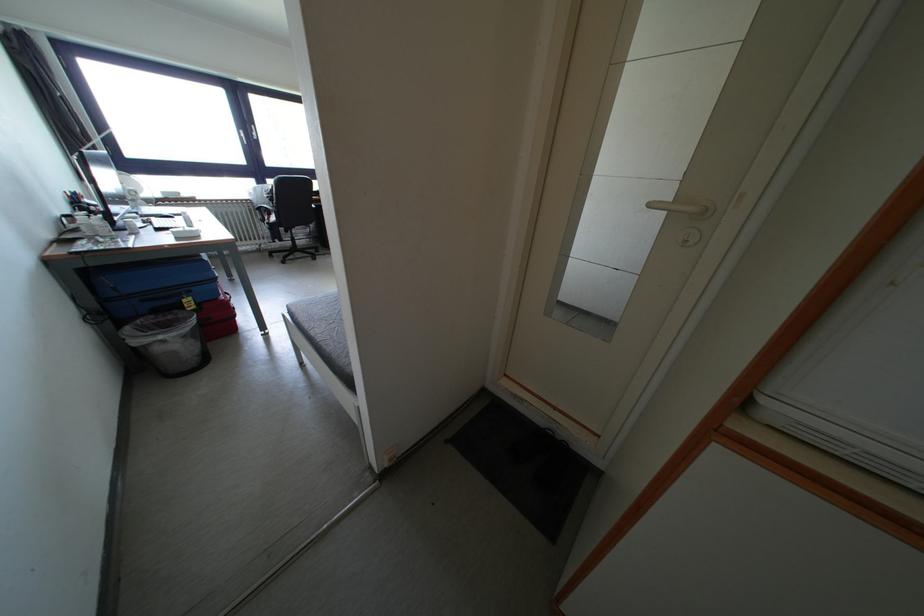
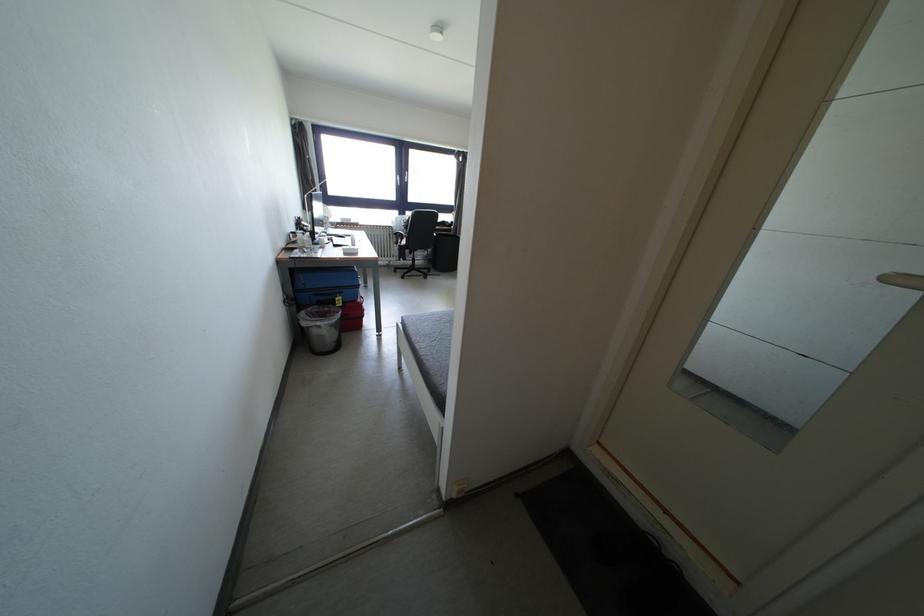
In the second image, find the point that corresponds to pixel 261 207 in the first image.

(400, 233)